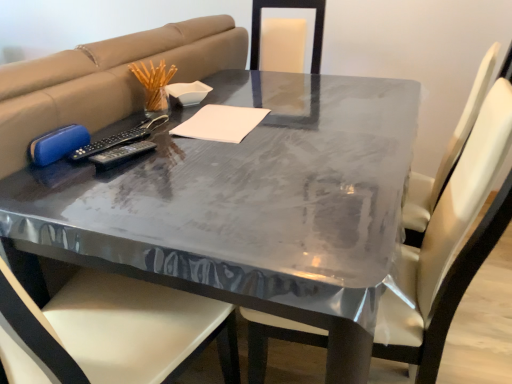
Question: Can you confirm if white paper at center is thinner than black plastic remote at center?

Choices:
 (A) yes
 (B) no

Answer: (B)

Question: From the image's perspective, is white paper at center under black plastic remote at center?

Choices:
 (A) no
 (B) yes

Answer: (A)

Question: From the image's perspective, is white paper at center over black plastic remote at center?

Choices:
 (A) yes
 (B) no

Answer: (A)

Question: Considering the relative positions of white paper at center and black plastic remote at center in the image provided, is white paper at center to the right of black plastic remote at center from the viewer's perspective?

Choices:
 (A) yes
 (B) no

Answer: (A)

Question: Does white paper at center have a lesser height compared to black plastic remote at center?

Choices:
 (A) yes
 (B) no

Answer: (A)

Question: From a real-world perspective, is glossy plastic table at center positioned above or below white leather chair at center?

Choices:
 (A) above
 (B) below

Answer: (B)

Question: Considering the positions of glossy plastic table at center and white leather chair at center in the image, is glossy plastic table at center bigger or smaller than white leather chair at center?

Choices:
 (A) big
 (B) small

Answer: (A)

Question: From their relative heights in the image, would you say glossy plastic table at center is taller or shorter than white leather chair at center?

Choices:
 (A) tall
 (B) short

Answer: (B)

Question: Relative to white leather chair at center, is glossy plastic table at center in front or behind?

Choices:
 (A) front
 (B) behind

Answer: (B)

Question: Considering the positions of white paper at center and white leather chair at center in the image, is white paper at center bigger or smaller than white leather chair at center?

Choices:
 (A) big
 (B) small

Answer: (B)

Question: Is point (202, 135) closer or farther from the camera than point (481, 180)?

Choices:
 (A) farther
 (B) closer

Answer: (A)

Question: Is white paper at center taller or shorter than white leather chair at center?

Choices:
 (A) short
 (B) tall

Answer: (A)

Question: Considering the positions of white paper at center and white leather chair at center in the image, is white paper at center wider or thinner than white leather chair at center?

Choices:
 (A) wide
 (B) thin

Answer: (B)

Question: Is glossy plastic table at center inside or outside of black plastic remote at center?

Choices:
 (A) inside
 (B) outside

Answer: (B)

Question: From a real-world perspective, is glossy plastic table at center above or below black plastic remote at center?

Choices:
 (A) below
 (B) above

Answer: (A)